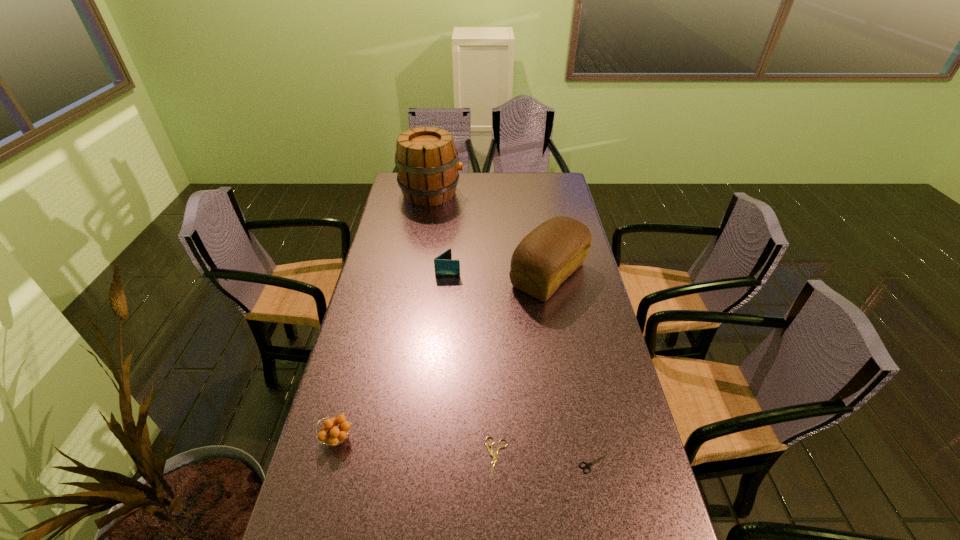
Where is `vacant area at the left edge of the desktop`? vacant area at the left edge of the desktop is located at coordinates (392, 217).

Where is `free region at the right edge of the desktop`? free region at the right edge of the desktop is located at coordinates (584, 412).

Image resolution: width=960 pixels, height=540 pixels. I want to click on free spot between the tallest object and the wallet, so click(440, 232).

I want to click on free space between the left shears and the bread, so click(x=523, y=366).

The width and height of the screenshot is (960, 540). I want to click on free space between the farthest object and the orange fruit, so click(384, 316).

You are a GUI agent. You are given a task and a screenshot of the screen. Output one action in this format:
    pyautogui.click(x=<x>, y=<y>)
    Task: Click on the free space between the third shortest object and the fourth object from left to right
    
    Given the screenshot: What is the action you would take?
    pyautogui.click(x=418, y=448)

Image resolution: width=960 pixels, height=540 pixels. I want to click on empty space between the second tallest object and the tallest object, so click(x=490, y=234).

You are a GUI agent. You are given a task and a screenshot of the screen. Output one action in this format:
    pyautogui.click(x=<x>, y=<y>)
    Task: Click on the free spot between the wallet and the third shortest object
    The height and width of the screenshot is (540, 960).
    Given the screenshot: What is the action you would take?
    (393, 354)

At what (x,y) coordinates should I click in order to perform the action: click on free area in between the right shears and the second tallest object. Please return your answer as a coordinate pair (x, y). The width and height of the screenshot is (960, 540). Looking at the image, I should click on (572, 369).

Where is `vacant point located between the right shears and the left shears`? The height and width of the screenshot is (540, 960). vacant point located between the right shears and the left shears is located at coordinates (545, 461).